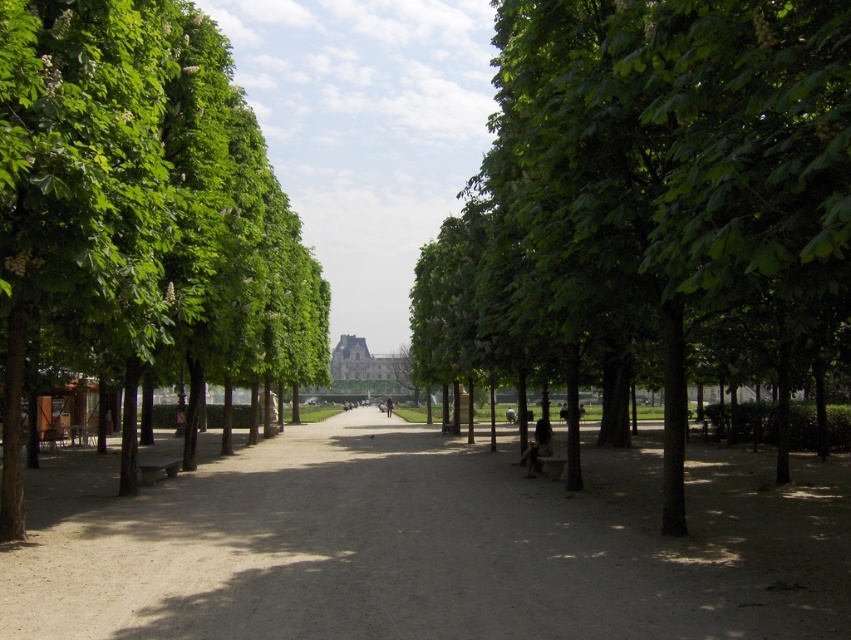
Who is positioned more to the left, green leafy tree at center or green leafy tree at left?

green leafy tree at left is more to the left.

Based on the photo, who is higher up, green leafy tree at center or green leafy tree at left?

green leafy tree at left is above.

Does point (641, 88) come farther from viewer compared to point (153, 364)?

No, it is not.

Image resolution: width=851 pixels, height=640 pixels. I want to click on green leafy tree at center, so click(x=644, y=184).

Between dirt path at center and green leafy tree at left, which one has more height?

Standing taller between the two is green leafy tree at left.

You are a GUI agent. You are given a task and a screenshot of the screen. Output one action in this format:
    pyautogui.click(x=<x>, y=<y>)
    Task: Click on the dirt path at center
    
    Given the screenshot: What is the action you would take?
    pyautogui.click(x=427, y=545)

Is point (477, 497) positioned in front of point (227, 257)?

That is True.

Find the location of `dirt path at center`. dirt path at center is located at coordinates (427, 545).

Who is positioned more to the left, dirt path at center or green leafy tree at center?

dirt path at center

Does dirt path at center lie in front of green leafy tree at center?

No, it is behind green leafy tree at center.

Which is behind, point (203, 513) or point (683, 316)?

Point (203, 513)

At what (x,y) coordinates should I click in order to perform the action: click on dirt path at center. Please return your answer as a coordinate pair (x, y). Looking at the image, I should click on (427, 545).